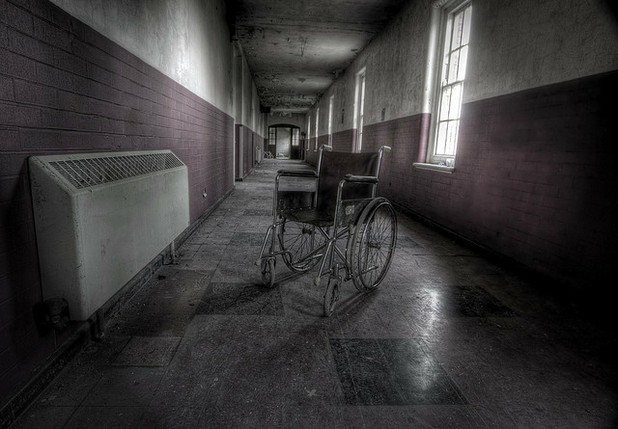
Find the location of a particular element. rotting ceiling is located at coordinates (269, 90).